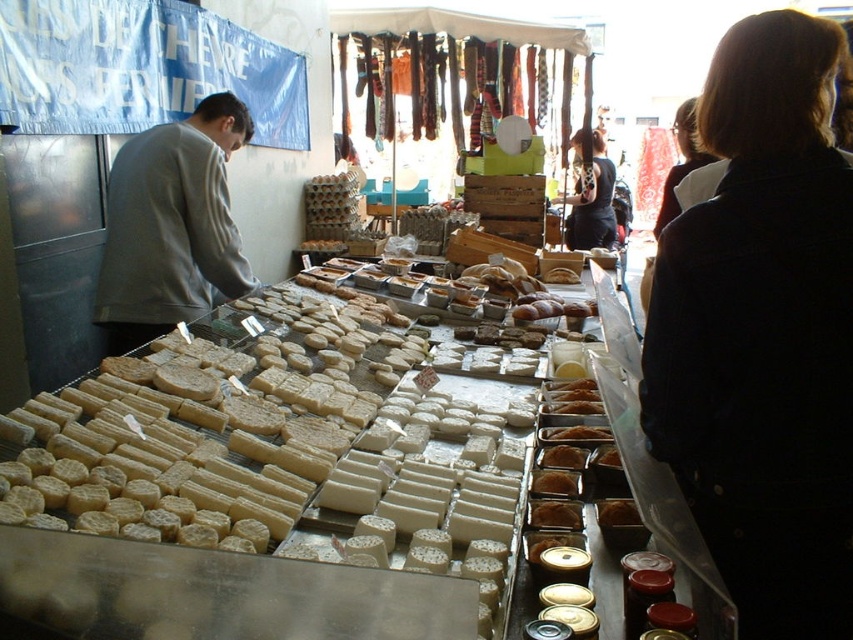
Question: Is gray matte sweatshirt at left positioned in front of dark brown hair at upper right?

Choices:
 (A) yes
 (B) no

Answer: (A)

Question: Is gray matte sweatshirt at left thinner than black leather jacket at center?

Choices:
 (A) no
 (B) yes

Answer: (A)

Question: Which of these objects is positioned farthest from the dark blue denim jacket at upper right?

Choices:
 (A) gray matte sweatshirt at left
 (B) black leather jacket at center

Answer: (B)

Question: Which object appears farthest from the camera in this image?

Choices:
 (A) dark brown hair at upper right
 (B) black leather jacket at center
 (C) gray matte sweatshirt at left
 (D) matte brown cheese at center

Answer: (B)

Question: Does gray matte sweatshirt at left appear under matte brown cheese at center?

Choices:
 (A) yes
 (B) no

Answer: (B)

Question: Based on their relative distances, which object is farther from the gray matte sweatshirt at left?

Choices:
 (A) black leather jacket at center
 (B) dark blue denim jacket at upper right
 (C) dark brown hair at upper right
 (D) matte brown cheese at center

Answer: (A)